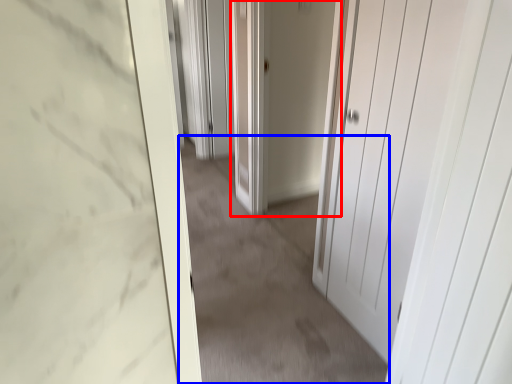
Question: Which of the following is the farthest to the observer, door (highlighted by a red box) or plain (highlighted by a blue box)?

Choices:
 (A) door
 (B) plain

Answer: (A)